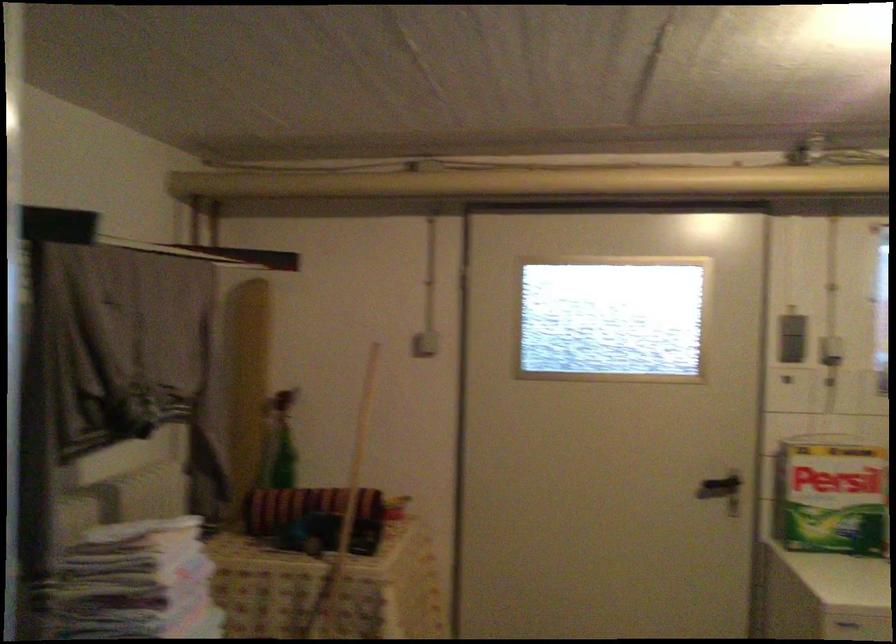
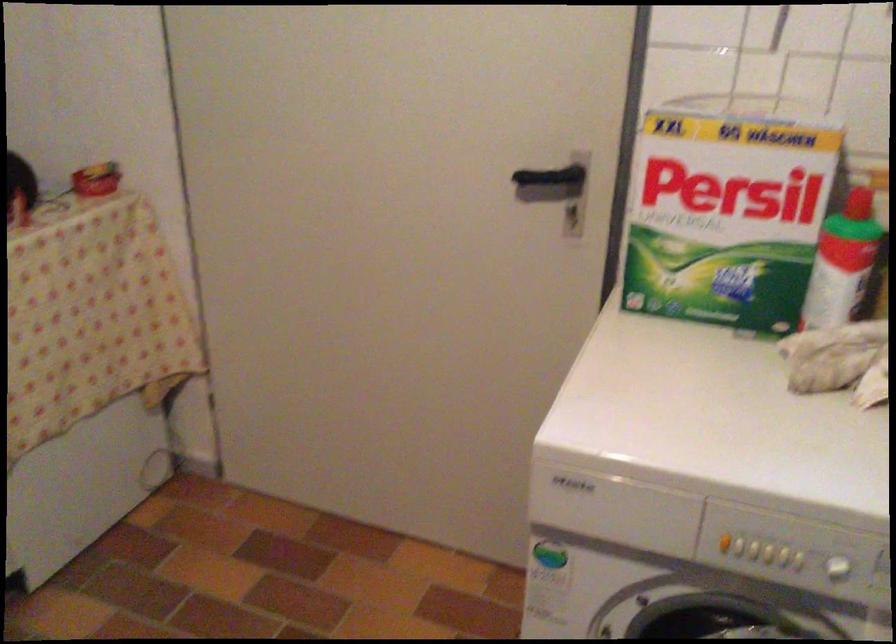
In the second image, find the point that corresponds to pixel 728 484 in the first image.

(553, 180)